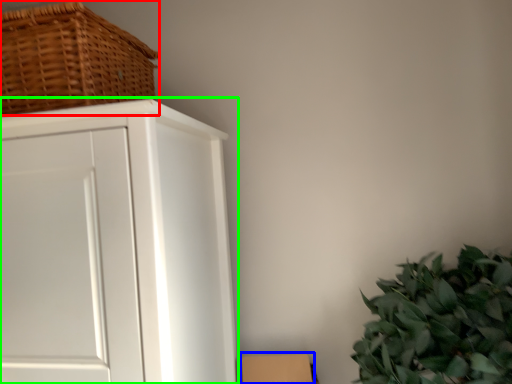
Question: Which object is positioned farthest from basket (highlighted by a red box)? Select from cardboard box (highlighted by a blue box) and cupboard (highlighted by a green box).

Choices:
 (A) cardboard box
 (B) cupboard

Answer: (A)